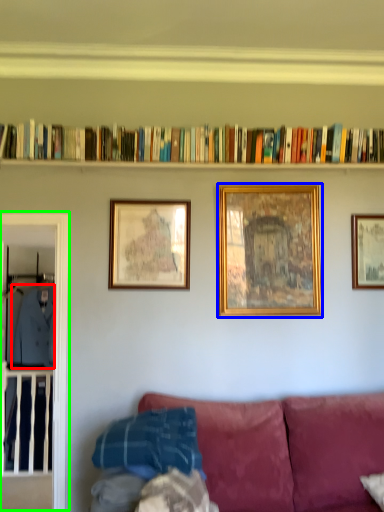
Question: Which is nearer to the clothing (highlighted by a red box)? picture frame (highlighted by a blue box) or glass door (highlighted by a green box).

Choices:
 (A) picture frame
 (B) glass door

Answer: (B)